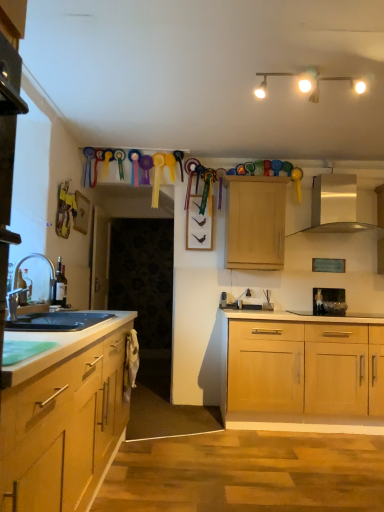
Where is `white matte track lights at upper center`? The image size is (384, 512). white matte track lights at upper center is located at coordinates (308, 83).

This screenshot has width=384, height=512. What do you see at coordinates (58, 345) in the screenshot?
I see `black granite countertop at lower left` at bounding box center [58, 345].

What is the approximate height of metallic stainless steel microwave at right?

metallic stainless steel microwave at right is 10.42 inches in height.

Find the location of a particular element. The height and width of the screenshot is (512, 384). metallic stainless steel microwave at right is located at coordinates (329, 301).

Describe the element at coordinates (362, 315) in the screenshot. I see `black glass gas stove at center` at that location.

Where is `light wood cabinet at upper center`? The width and height of the screenshot is (384, 512). light wood cabinet at upper center is located at coordinates (255, 222).

Would you consider metallic stainless steel microwave at right to be distant from black glass gas stove at center?

That's not correct — metallic stainless steel microwave at right is a little close to black glass gas stove at center.

Can you confirm if metallic stainless steel microwave at right is smaller than black glass gas stove at center?

Yes, metallic stainless steel microwave at right is smaller than black glass gas stove at center.

Looking at their sizes, would you say metallic stainless steel microwave at right is wider or thinner than black glass gas stove at center?

Considering their sizes, metallic stainless steel microwave at right looks slimmer than black glass gas stove at center.

Which is in front, black glass gas stove at center or silver metallic faucet at left?

silver metallic faucet at left.

Would you say black glass gas stove at center is to the left or to the right of silver metallic faucet at left in the picture?

black glass gas stove at center is to the right of silver metallic faucet at left.

Which is in front, point (364, 316) or point (26, 295)?

The point (26, 295) is more forward.

Is black glass gas stove at center not within silver metallic faucet at left?

Absolutely, black glass gas stove at center is external to silver metallic faucet at left.

Who is shorter, white matte track lights at upper center or metallic stainless steel microwave at right?

white matte track lights at upper center is shorter.

Which object is more forward, white matte track lights at upper center or metallic stainless steel microwave at right?

Positioned in front is white matte track lights at upper center.

How distant is white matte track lights at upper center from metallic stainless steel microwave at right?

They are 2.01 meters apart.

Which is behind, point (316, 95) or point (317, 314)?

The point (317, 314) is behind.

Is the depth of metallic stainless steel microwave at right less than that of white matte track lights at upper center?

No, metallic stainless steel microwave at right is behind white matte track lights at upper center.

Is point (313, 306) behind point (312, 96)?

Yes, point (313, 306) is farther from viewer.

In the scene shown: From the image's perspective, which is above, metallic stainless steel microwave at right or white matte track lights at upper center?

white matte track lights at upper center, from the image's perspective.

Is metallic stainless steel microwave at right far away from white matte track lights at upper center?

metallic stainless steel microwave at right is far away from white matte track lights at upper center.

Which object is thinner, silver metallic exhaust hood at upper center or light wood cabinet at upper center?

light wood cabinet at upper center is thinner.

From the picture: Is silver metallic exhaust hood at upper center behind light wood cabinet at upper center?

No, the depth of silver metallic exhaust hood at upper center is less than that of light wood cabinet at upper center.

From a real-world perspective, is silver metallic exhaust hood at upper center under light wood cabinet at upper center?

No, from a real-world perspective, silver metallic exhaust hood at upper center is not below light wood cabinet at upper center.

Between silver metallic exhaust hood at upper center and light wood cabinet at upper center, which one appears on the left side from the viewer's perspective?

From the viewer's perspective, light wood cabinet at upper center appears more on the left side.

Which is nearer, (346, 309) or (248, 223)?

Positioned in front is point (248, 223).

From the image's perspective, which one is positioned higher, metallic stainless steel microwave at right or light wood cabinet at upper center?

light wood cabinet at upper center appears higher in the image.

How different are the orientations of metallic stainless steel microwave at right and light wood cabinet at upper center in degrees?

The facing directions of metallic stainless steel microwave at right and light wood cabinet at upper center are 1.31 degrees apart.

Where is `cabinetry in front of the metallic stainless steel microwave at right`? cabinetry in front of the metallic stainless steel microwave at right is located at coordinates (255, 222).

Between metallic stainless steel microwave at right and silver metallic faucet at left, which one has smaller size?

metallic stainless steel microwave at right.

From a real-world perspective, does metallic stainless steel microwave at right stand above silver metallic faucet at left?

Incorrect, from a real-world perspective, metallic stainless steel microwave at right is lower than silver metallic faucet at left.

Who is more distant, metallic stainless steel microwave at right or silver metallic faucet at left?

metallic stainless steel microwave at right is behind.

Is point (325, 313) closer or farther from the camera than point (46, 257)?

Point (325, 313) appears to be farther away from the viewer than point (46, 257).

You are a GUI agent. You are given a task and a screenshot of the screen. Output one action in this format:
    pyautogui.click(x=<x>, y=<y>)
    Task: Click on the appliance that is behind the black glass gas stove at center
    
    Given the screenshot: What is the action you would take?
    (x=329, y=301)

This screenshot has width=384, height=512. Identify the location of gas stove that is on the right side of silver metallic faucet at left. (362, 315).

Based on their spatial positions, is silver metallic exhaust hood at upper center or silver metallic faucet at left further from black glass gas stove at center?

silver metallic faucet at left lies further to black glass gas stove at center than the other object.

Estimate the real-world distances between objects in this image. Which object is further from silver metallic faucet at left, silver metallic exhaust hood at upper center or black glass gas stove at center?

Among the two, silver metallic exhaust hood at upper center is located further to silver metallic faucet at left.

Based on their spatial positions, is white matte track lights at upper center or silver metallic exhaust hood at upper center closer to metallic stainless steel microwave at right?

Among the two, silver metallic exhaust hood at upper center is located nearer to metallic stainless steel microwave at right.

Based on their spatial positions, is silver metallic faucet at left or light wood cabinet at upper center further from black granite countertop at lower left?

light wood cabinet at upper center is positioned further to the anchor black granite countertop at lower left.

Based on their spatial positions, is white matte track lights at upper center or black granite countertop at lower left closer to black glass gas stove at center?

white matte track lights at upper center lies closer to black glass gas stove at center than the other object.

Estimate the real-world distances between objects in this image. Which object is closer to metallic stainless steel microwave at right, black glass gas stove at center or white matte track lights at upper center?

black glass gas stove at center.

Considering their positions, is metallic stainless steel microwave at right positioned closer to white matte track lights at upper center than silver metallic faucet at left?

Based on the image, silver metallic faucet at left appears to be nearer to white matte track lights at upper center.

Looking at the image, which one is located closer to metallic stainless steel microwave at right, black glass gas stove at center or black granite countertop at lower left?

black glass gas stove at center is closer to metallic stainless steel microwave at right.

Identify the location of lamp situated between silver metallic faucet at left and silver metallic exhaust hood at upper center from left to right. The height and width of the screenshot is (512, 384). (308, 83).

The height and width of the screenshot is (512, 384). I want to click on gas stove situated between black granite countertop at lower left and silver metallic exhaust hood at upper center from left to right, so click(362, 315).

Where is `exhaust hood located between white matte track lights at upper center and metallic stainless steel microwave at right in the depth direction`? The height and width of the screenshot is (512, 384). exhaust hood located between white matte track lights at upper center and metallic stainless steel microwave at right in the depth direction is located at coordinates (334, 205).

I want to click on gas stove between black granite countertop at lower left and light wood cabinet at upper center in the front-back direction, so pyautogui.click(x=362, y=315).